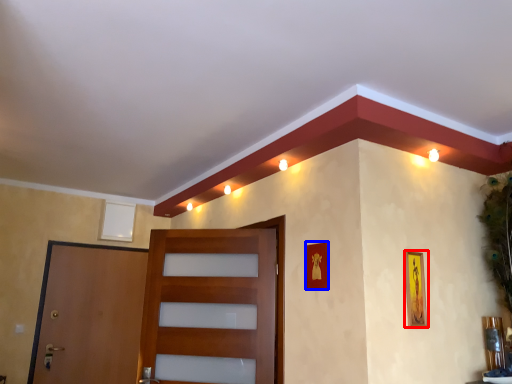
Question: Among these objects, which one is farthest to the camera, picture frame (highlighted by a red box) or picture frame (highlighted by a blue box)?

Choices:
 (A) picture frame
 (B) picture frame

Answer: (B)